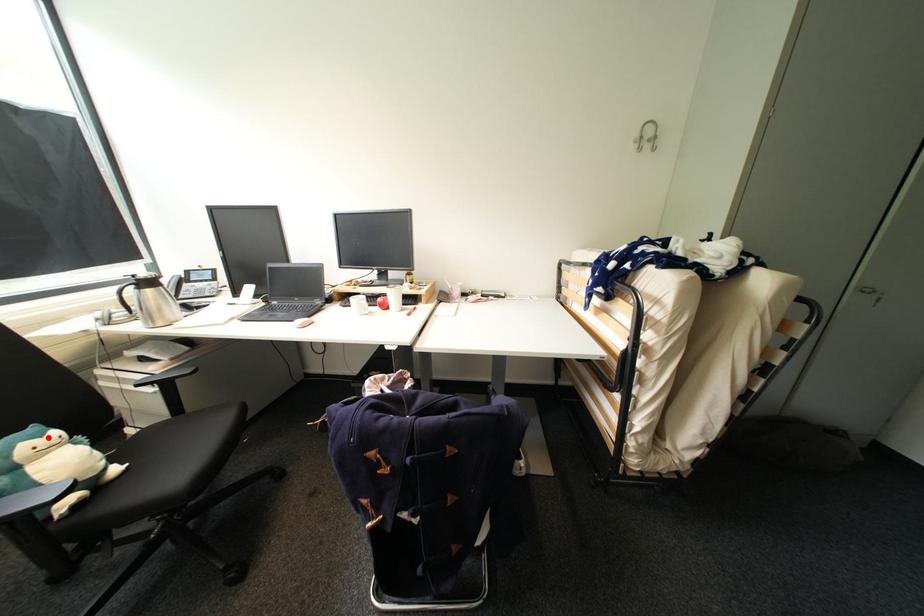
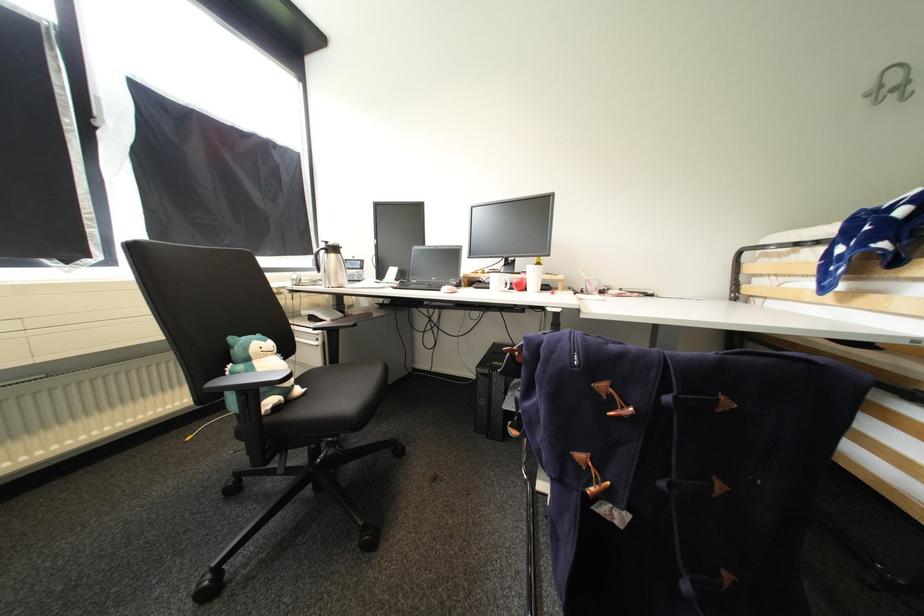
Question: I am providing you with two images of the same scene from different viewpoints. Given a red point in image1, look at the same physical point in image2. Is it:

Choices:
 (A) Closer to the viewpoint
 (B) Farther from the viewpoint

Answer: (A)